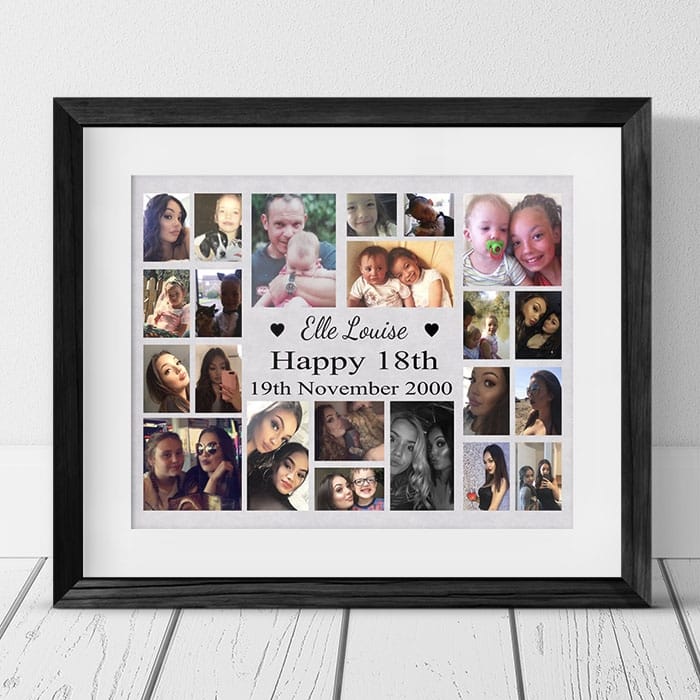
Where is `edge of  wooden panel under picture`? edge of  wooden panel under picture is located at coordinates (276, 328), (434, 329), (4, 624), (150, 679), (340, 693), (518, 671), (694, 657).